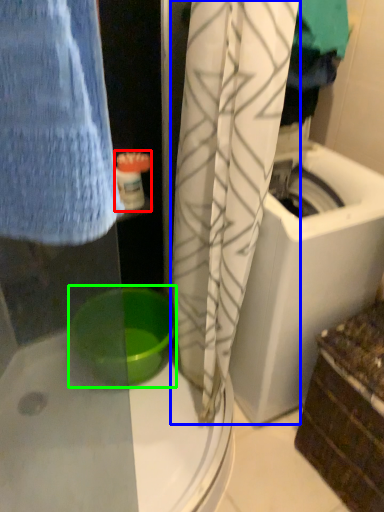
Question: Which object is the closest to the toiletry (highlighted by a red box)? Choose among these: curtain (highlighted by a blue box) or basin (highlighted by a green box).

Choices:
 (A) curtain
 (B) basin

Answer: (A)